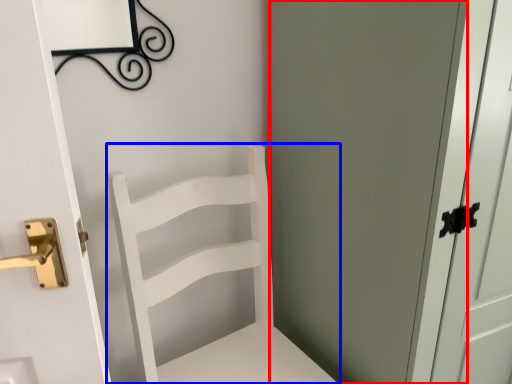
Question: Which of the following is the closest to the observer, screen door (highlighted by a red box) or furniture (highlighted by a blue box)?

Choices:
 (A) screen door
 (B) furniture

Answer: (A)